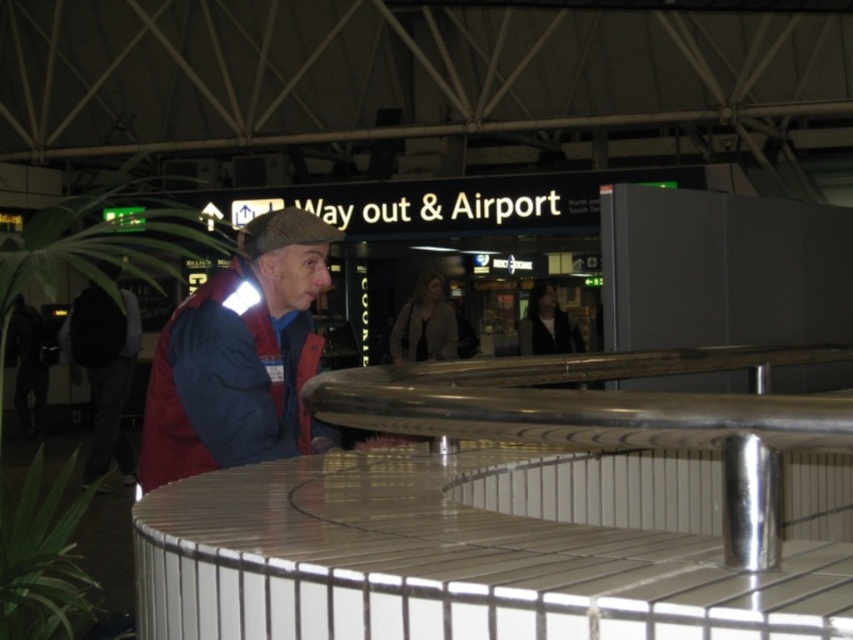
Question: Which of the following is the farthest from the observer?

Choices:
 (A) (94, 413)
 (B) (322, 240)

Answer: (A)

Question: Does matte red jacket at center have a smaller size compared to dark blue jacket at center?

Choices:
 (A) yes
 (B) no

Answer: (A)

Question: Which point is closer to the camera?

Choices:
 (A) (91, 365)
 (B) (252, 449)

Answer: (B)

Question: Is matte red jacket at center above dark blue jacket at center?

Choices:
 (A) no
 (B) yes

Answer: (B)

Question: Can you confirm if matte red jacket at center is wider than dark blue jacket at center?

Choices:
 (A) no
 (B) yes

Answer: (A)